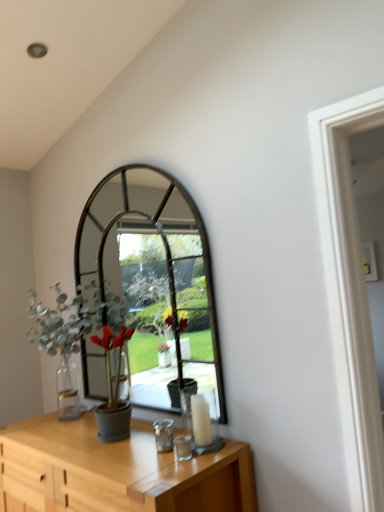
You are a GUI agent. You are given a task and a screenshot of the screen. Output one action in this format:
    pyautogui.click(x=<x>, y=<y>)
    Task: Click on the free point above light wood table at lower center (from a real-world perspective)
    
    Given the screenshot: What is the action you would take?
    pyautogui.click(x=101, y=446)